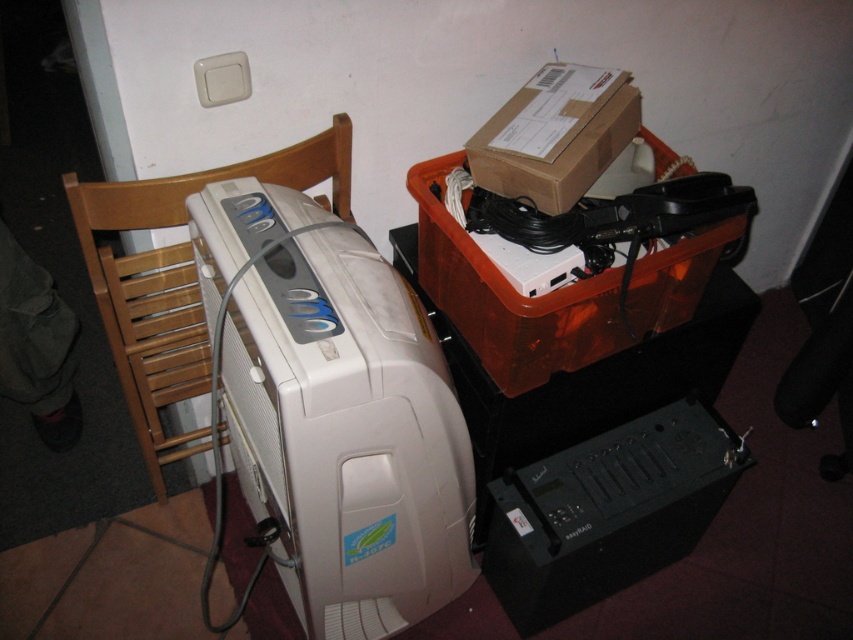
Question: Which point is farther to the camera?

Choices:
 (A) click(357, 381)
 (B) click(577, 173)

Answer: (B)

Question: Which point is closer to the camera taking this photo?

Choices:
 (A) (624, 365)
 (B) (589, 161)

Answer: (B)

Question: Can you confirm if white plastic printer at left is positioned below brown cardboard box at upper right?

Choices:
 (A) yes
 (B) no

Answer: (A)

Question: Which object is positioned closest to the white plastic printer at left?

Choices:
 (A) black plastic table at lower right
 (B) wooden at left
 (C) brown cardboard box at upper right

Answer: (B)

Question: Where is white plastic printer at left located in relation to wooden at left in the image?

Choices:
 (A) right
 (B) left

Answer: (A)

Question: Is wooden at left positioned before brown cardboard box at upper right?

Choices:
 (A) no
 (B) yes

Answer: (B)